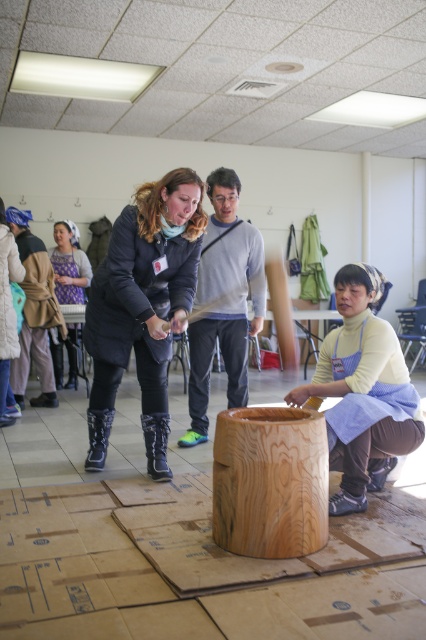
Is point (363, 360) positioned behind point (71, 278)?

No, it is not.

Who is higher up, wooden bowl at lower center or matte black jacket at left?

Positioned higher is matte black jacket at left.

Does point (370, 276) lie behind point (48, 252)?

No, it is in front of (48, 252).

This screenshot has width=426, height=640. What are the coordinates of `wooden bowl at lower center` in the screenshot? It's located at (362, 390).

Between matte black jacket at center and matte black jacket at left, which one appears on the left side from the viewer's perspective?

Positioned to the left is matte black jacket at left.

Does point (126, 324) lie in front of point (55, 266)?

Yes, it is in front of point (55, 266).

The image size is (426, 640). I want to click on matte black jacket at center, so click(143, 307).

Who is higher up, matte black jacket at center or natural wood cylinder at center?

matte black jacket at center

Between point (89, 339) and point (256, 484), which one is positioned in front?

Point (256, 484) is more forward.

Locate an element on the screen. The image size is (426, 640). matte black jacket at center is located at coordinates (143, 307).